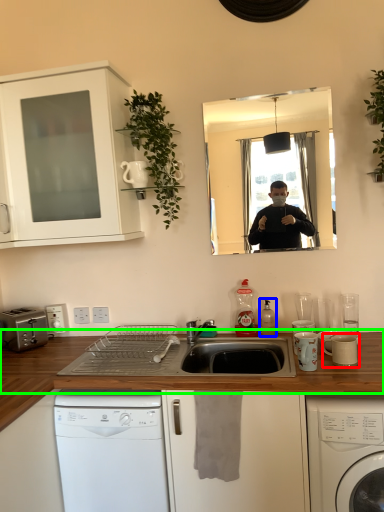
Question: Considering the real-world distances, which object is closest to appliance (highlighted by a red box)? bottle (highlighted by a blue box) or countertop (highlighted by a green box).

Choices:
 (A) bottle
 (B) countertop

Answer: (A)